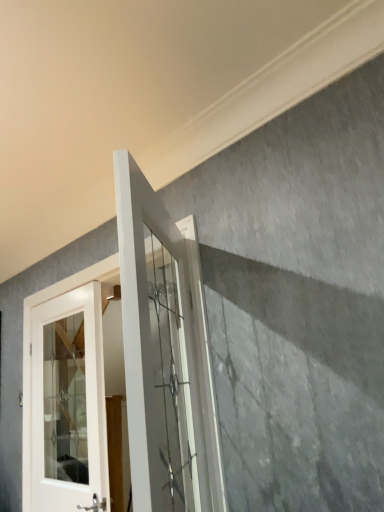
What is the approximate width of white glass door at center, which is counted as the 2th door, starting from the left?

It is 4.21 inches.

Describe the element at coordinates (158, 352) in the screenshot. I see `white glass door at center, positioned as the first door in right-to-left order` at that location.

The height and width of the screenshot is (512, 384). Find the location of `white glass door at center, which ranks as the first door in front-to-back order`. white glass door at center, which ranks as the first door in front-to-back order is located at coordinates (158, 352).

The image size is (384, 512). What do you see at coordinates (68, 402) in the screenshot?
I see `white glass door at left, placed as the 1th door when sorted from left to right` at bounding box center [68, 402].

Find the location of a particular element. white glass door at left, which ranks as the 2th door in right-to-left order is located at coordinates (68, 402).

Locate an element on the screen. white glass door at center, which ranks as the first door in front-to-back order is located at coordinates (158, 352).

Which object is positioned more to the left, white glass door at center, which is counted as the 2th door, starting from the back, or white glass door at left, arranged as the 2th door when viewed from the front?

white glass door at left, arranged as the 2th door when viewed from the front, is more to the left.

Which is in front, white glass door at center, which is counted as the 2th door, starting from the back, or white glass door at left, placed as the 1th door when sorted from left to right?

white glass door at center, which is counted as the 2th door, starting from the back.

Considering the positions of point (145, 470) and point (74, 383), is point (145, 470) closer or farther from the camera than point (74, 383)?

Point (145, 470) appears to be closer to the viewer than point (74, 383).

From the image's perspective, is white glass door at center, which is counted as the 2th door, starting from the back, beneath white glass door at left, which ranks as the 2th door in right-to-left order?

Actually, white glass door at center, which is counted as the 2th door, starting from the back, appears above white glass door at left, which ranks as the 2th door in right-to-left order, in the image.

From a real-world perspective, is white glass door at center, which is counted as the 2th door, starting from the back, beneath white glass door at left, which ranks as the 2th door in right-to-left order?

No, from a real-world perspective, white glass door at center, which is counted as the 2th door, starting from the back, is not beneath white glass door at left, which ranks as the 2th door in right-to-left order.

Looking at this image, can you confirm if white glass door at center, which is counted as the 2th door, starting from the left, is wider than white glass door at left, which ranks as the 2th door in right-to-left order?

Yes.

Considering the sizes of objects white glass door at center, positioned as the first door in right-to-left order, and white glass door at left, positioned as the 1th door in back-to-front order, in the image provided, who is shorter, white glass door at center, positioned as the first door in right-to-left order, or white glass door at left, positioned as the 1th door in back-to-front order,?

white glass door at center, positioned as the first door in right-to-left order.

Considering the sizes of white glass door at center, which is counted as the 2th door, starting from the left, and white glass door at left, which ranks as the 2th door in right-to-left order, in the image, is white glass door at center, which is counted as the 2th door, starting from the left, bigger or smaller than white glass door at left, which ranks as the 2th door in right-to-left order,?

white glass door at center, which is counted as the 2th door, starting from the left, is bigger than white glass door at left, which ranks as the 2th door in right-to-left order.

Based on the photo, is white glass door at center, positioned as the first door in right-to-left order, inside or outside of white glass door at left, which ranks as the 2th door in right-to-left order?

white glass door at center, positioned as the first door in right-to-left order, exists outside the volume of white glass door at left, which ranks as the 2th door in right-to-left order.

Is the surface of white glass door at center, which is counted as the 2th door, starting from the left, in direct contact with white glass door at left, arranged as the 2th door when viewed from the front?

No.

Is white glass door at center, which ranks as the first door in front-to-back order, facing away from white glass door at left, which ranks as the 2th door in right-to-left order?

No, white glass door at center, which ranks as the first door in front-to-back order, is not facing away from white glass door at left, which ranks as the 2th door in right-to-left order.

Based on the photo, what's the angular difference between white glass door at center, which ranks as the first door in front-to-back order, and white glass door at left, positioned as the 1th door in back-to-front order,'s facing directions?

The angular difference between white glass door at center, which ranks as the first door in front-to-back order, and white glass door at left, positioned as the 1th door in back-to-front order, is 54.1 degrees.

This screenshot has height=512, width=384. Find the location of `door below the white glass door at center, which is counted as the 2th door, starting from the left (from the image's perspective)`. door below the white glass door at center, which is counted as the 2th door, starting from the left (from the image's perspective) is located at coordinates (68, 402).

Is white glass door at left, positioned as the 1th door in back-to-front order, at the left side of white glass door at center, which is counted as the 2th door, starting from the back?

Yes.

Between white glass door at left, placed as the 1th door when sorted from left to right, and white glass door at center, which ranks as the first door in front-to-back order, which one is positioned in front?

white glass door at center, which ranks as the first door in front-to-back order, is in front.

Does point (66, 507) come behind point (153, 210)?

Yes, point (66, 507) is farther from viewer.

From the image's perspective, who appears lower, white glass door at left, which ranks as the 2th door in right-to-left order, or white glass door at center, which is counted as the 2th door, starting from the left?

white glass door at left, which ranks as the 2th door in right-to-left order, appears lower in the image.

From a real-world perspective, which object rests below the other?

In real-world perspective, white glass door at left, placed as the 1th door when sorted from left to right, is lower.

Is white glass door at left, positioned as the 1th door in back-to-front order, wider or thinner than white glass door at center, which is counted as the 2th door, starting from the back?

white glass door at left, positioned as the 1th door in back-to-front order, is thinner than white glass door at center, which is counted as the 2th door, starting from the back.

Which of these two, white glass door at left, placed as the 1th door when sorted from left to right, or white glass door at center, which is counted as the 2th door, starting from the left, stands shorter?

white glass door at center, which is counted as the 2th door, starting from the left.

Between white glass door at left, which ranks as the 2th door in right-to-left order, and white glass door at center, positioned as the first door in right-to-left order, which one has smaller size?

With smaller size is white glass door at left, which ranks as the 2th door in right-to-left order.

Is white glass door at left, which ranks as the 2th door in right-to-left order, outside of white glass door at center, which is counted as the 2th door, starting from the back?

Absolutely, white glass door at left, which ranks as the 2th door in right-to-left order, is external to white glass door at center, which is counted as the 2th door, starting from the back.

Are white glass door at left, placed as the 1th door when sorted from left to right, and white glass door at center, positioned as the first door in right-to-left order, beside each other?

No, white glass door at left, placed as the 1th door when sorted from left to right, is not in contact with white glass door at center, positioned as the first door in right-to-left order.

Is white glass door at center, which is counted as the 2th door, starting from the left, at the back of white glass door at left, arranged as the 2th door when viewed from the front?

No, white glass door at left, arranged as the 2th door when viewed from the front, is not facing away from white glass door at center, which is counted as the 2th door, starting from the left.

How distant is white glass door at left, placed as the 1th door when sorted from left to right, from white glass door at center, positioned as the first door in right-to-left order?

The distance of white glass door at left, placed as the 1th door when sorted from left to right, from white glass door at center, positioned as the first door in right-to-left order, is 4.50 feet.

Locate an element on the screen. The image size is (384, 512). door lying in front of the white glass door at left, placed as the 1th door when sorted from left to right is located at coordinates (158, 352).

Identify the location of door on the right of white glass door at left, which ranks as the 2th door in right-to-left order. This screenshot has height=512, width=384. (158, 352).

In order to click on door above the white glass door at left, arranged as the 2th door when viewed from the front (from the image's perspective) in this screenshot , I will do `click(158, 352)`.